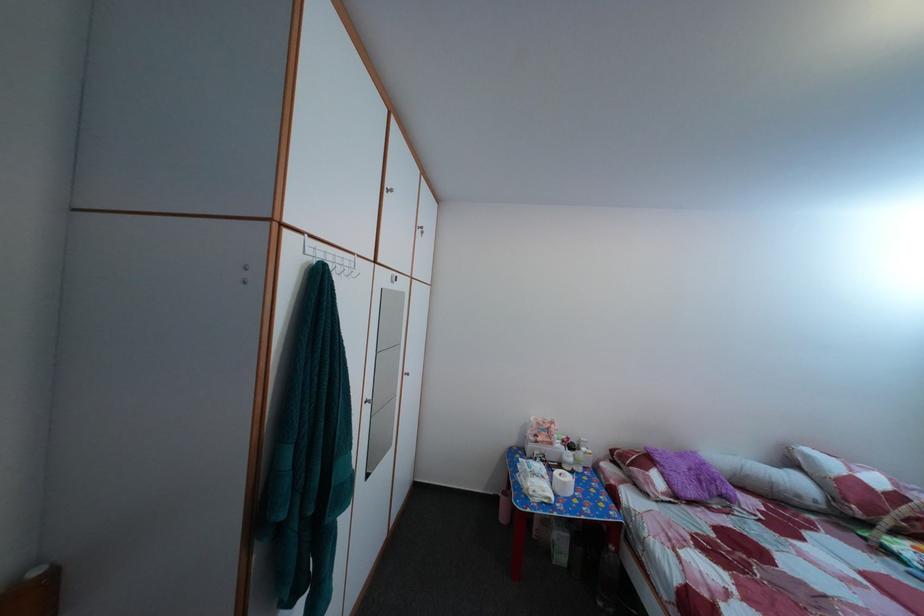
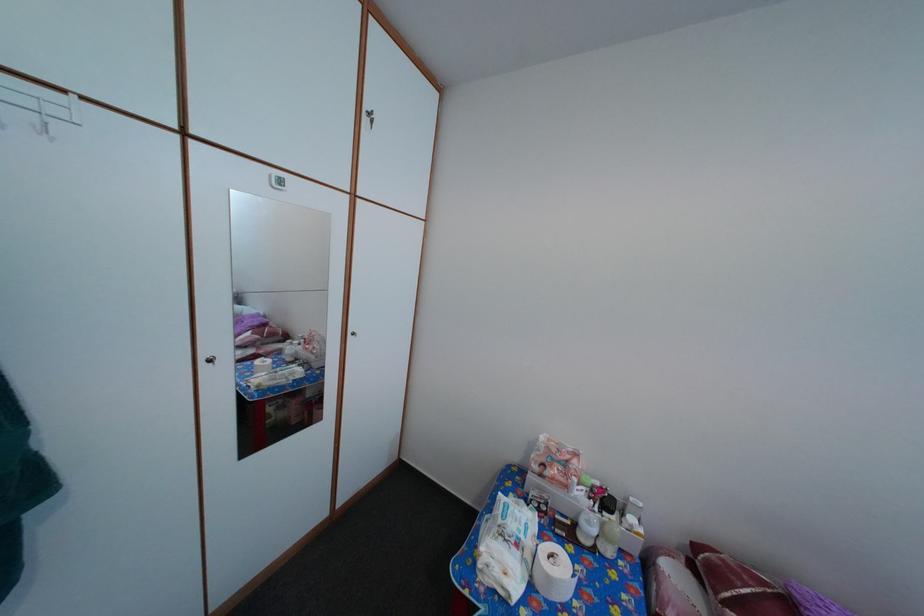
In the second image, find the point that corresponds to (x=622, y=459) in the first image.

(704, 554)